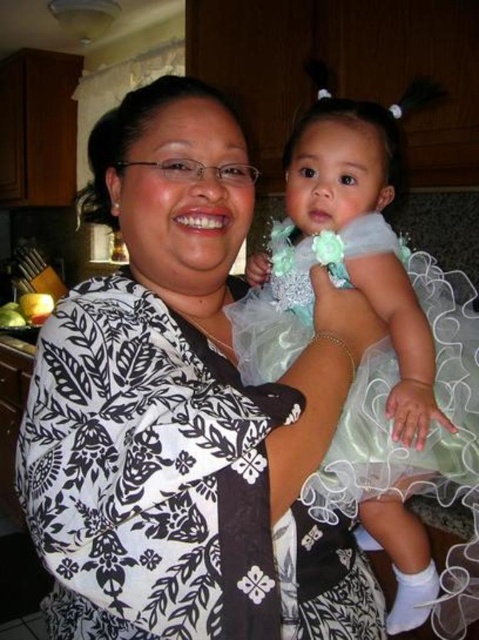
Does white printed dress at center appear under tulle dress at center?

Incorrect, white printed dress at center is not positioned below tulle dress at center.

Is point (110, 380) more distant than point (309, 157)?

That is False.

Is point (136, 552) positioned before point (459, 428)?

Yes, point (136, 552) is in front of point (459, 428).

Where is `white printed dress at center`? The width and height of the screenshot is (479, 640). white printed dress at center is located at coordinates (184, 412).